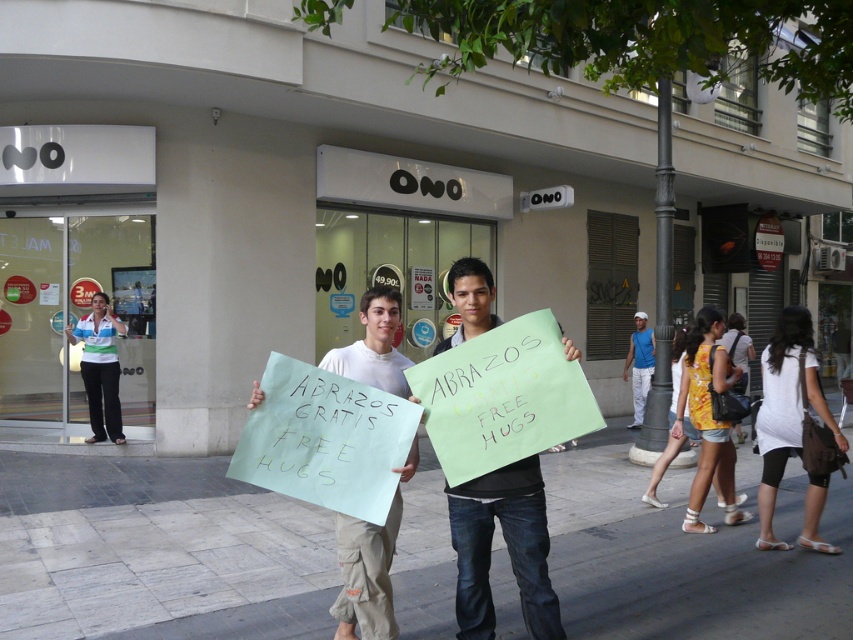
Can you confirm if light blue paper sign at center is thinner than blue sleeveless shirt at right?

Incorrect, light blue paper sign at center's width is not less than blue sleeveless shirt at right's.

Who is positioned more to the left, light blue paper sign at center or blue sleeveless shirt at right?

light blue paper sign at center is more to the left.

Is point (405, 467) closer to camera compared to point (637, 388)?

Yes.

The height and width of the screenshot is (640, 853). I want to click on light blue paper sign at center, so pos(366,576).

Is white fabric shirt at center positioned in front of blue sleeveless shirt at right?

Yes.

Who is higher up, white fabric shirt at center or blue sleeveless shirt at right?

blue sleeveless shirt at right is above.

Identify the location of white fabric shirt at center. The image size is (853, 640). (786, 410).

Does gray concrete pavement at center appear over blue sleeveless shirt at right?

Actually, gray concrete pavement at center is below blue sleeveless shirt at right.

Based on the photo, does gray concrete pavement at center appear on the left side of blue sleeveless shirt at right?

Indeed, gray concrete pavement at center is positioned on the left side of blue sleeveless shirt at right.

Find the location of a particular element. gray concrete pavement at center is located at coordinates (160, 554).